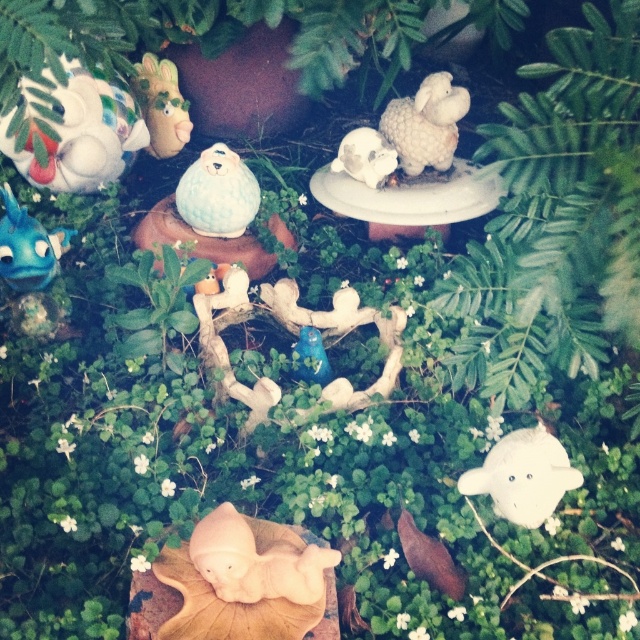
Question: Does matte ceramic egg at center have a greater width compared to matte beige lamb at lower center?

Choices:
 (A) yes
 (B) no

Answer: (A)

Question: Does white matte sheep at lower right appear on the left side of white glossy skull at center?

Choices:
 (A) yes
 (B) no

Answer: (B)

Question: Among these points, which one is nearest to the camera?

Choices:
 (A) (106, 97)
 (B) (164, 100)
 (C) (227, 227)
 (D) (188, 180)

Answer: (C)

Question: Which of the following is the farthest from the observer?

Choices:
 (A) (545, 241)
 (B) (192, 170)
 (C) (198, 164)

Answer: (B)

Question: Does matte white figurine at upper left have a greater width compared to white matte sheep at lower right?

Choices:
 (A) yes
 (B) no

Answer: (A)

Question: Which of the following is the closest to the observer?

Choices:
 (A) green leafy fern at upper center
 (B) matte white sheep at upper right
 (C) matte beige lamb at lower center

Answer: (C)